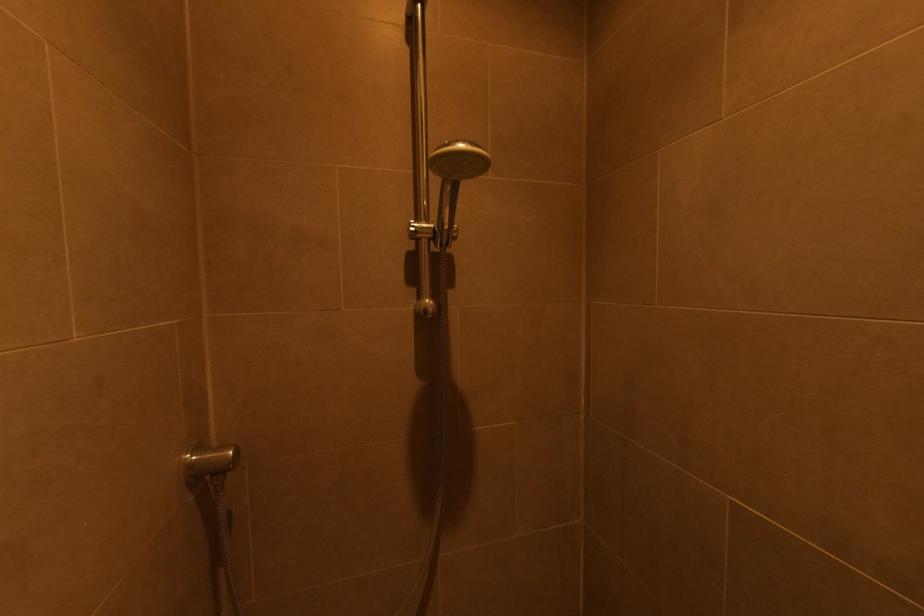
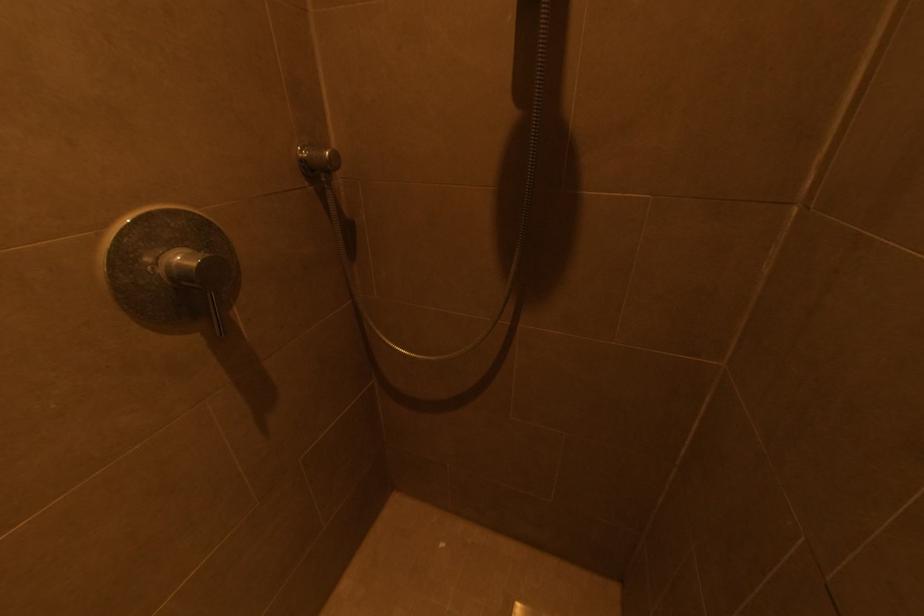
First-person continuous shooting, in which direction is the camera rotating?

The camera rotated toward left-down.